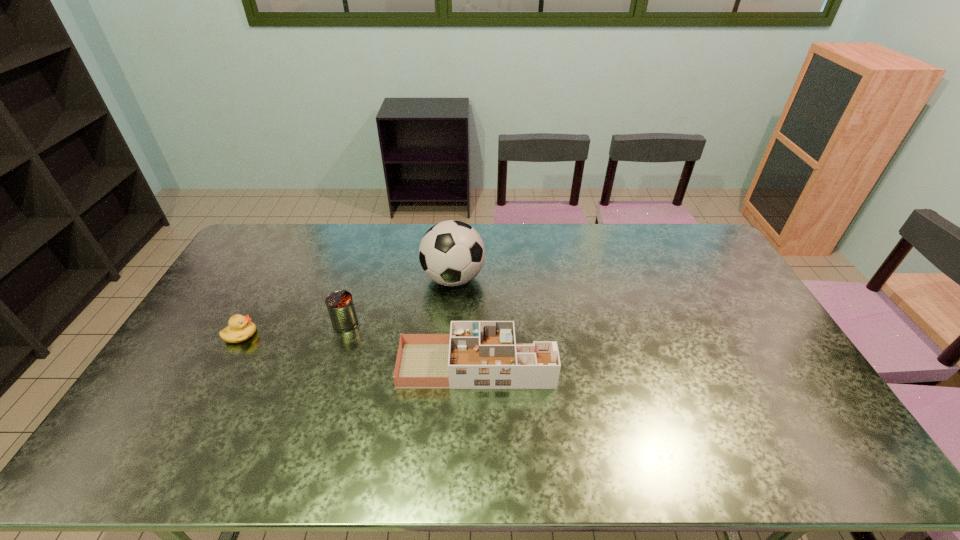
Identify the location of blank area located on the beak of the leftmost object. The height and width of the screenshot is (540, 960). (382, 335).

I want to click on object that is at the far edge, so click(x=451, y=253).

At what (x,y) coordinates should I click in order to perform the action: click on object present at the left edge. Please return your answer as a coordinate pair (x, y). The height and width of the screenshot is (540, 960). Looking at the image, I should click on (240, 329).

In the image, there is a desktop. Where is `free space at the far edge`? Image resolution: width=960 pixels, height=540 pixels. free space at the far edge is located at coordinates (560, 240).

Find the location of a particular element. Image resolution: width=960 pixels, height=540 pixels. blank space at the near edge of the desktop is located at coordinates (755, 444).

Where is `blank area at the left edge`? The width and height of the screenshot is (960, 540). blank area at the left edge is located at coordinates (151, 434).

I want to click on free space at the right edge of the desktop, so click(799, 379).

Image resolution: width=960 pixels, height=540 pixels. Find the location of `vacant space at the far left corner of the desktop`. vacant space at the far left corner of the desktop is located at coordinates (259, 228).

Identify the location of free region at the near left corner of the desktop. (131, 470).

What are the coordinates of `vacant area that lies between the farthest object and the can` in the screenshot? It's located at (399, 301).